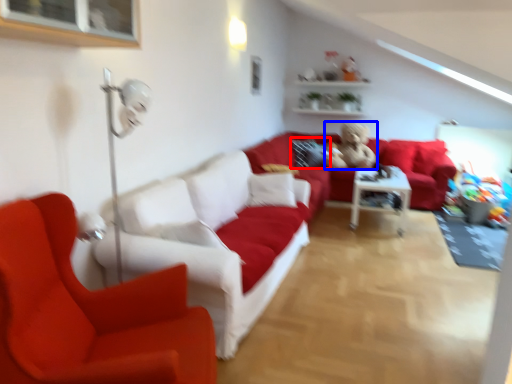
Question: Which point is closer to the camera, pillow (highlighted by a red box) or figurine (highlighted by a blue box)?

Choices:
 (A) pillow
 (B) figurine

Answer: (B)